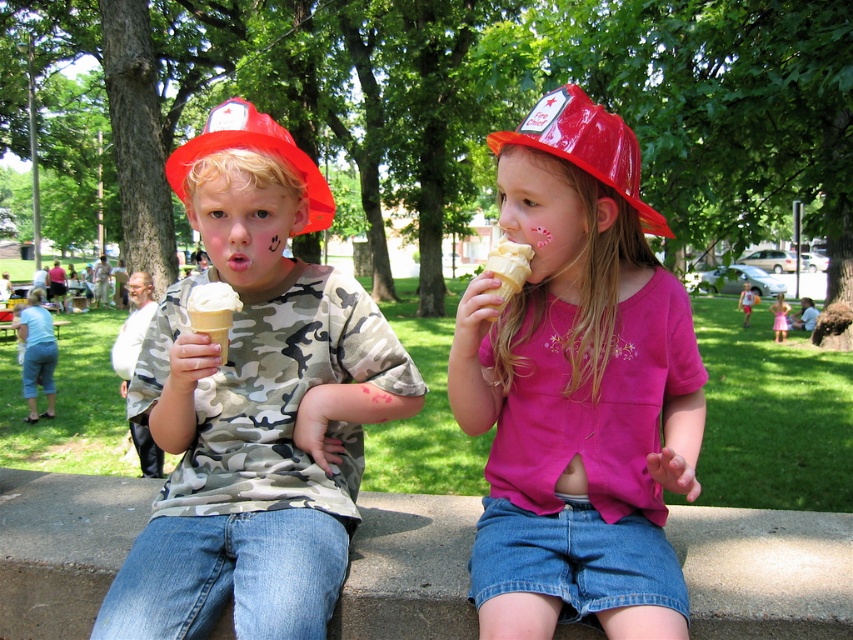
You are a photographer trying to capture both the white creamy ice cream cone at center and the vanilla ice cream at center in a single shot. Given that your camera has a maximum focus range of 25 inches, will you be able to include both in the frame without moving the camera?

The distance between the white creamy ice cream cone at center and the vanilla ice cream at center is 25.49 inches. Since this exceeds the camera maximum focus range of 25 inches, you will not be able to include both in the frame without moving the camera.

You are a photographer trying to capture a photo of the vanilla ice cream at center and the pink satin dress at center. If you want to ensure both objects are fully visible in the frame, which object should you adjust your focus to prioritize based on their sizes?

The vanilla ice cream at center is wider than the pink satin dress at center, so you should prioritize focusing on the vanilla ice cream at center to ensure it fits within the frame.

You are a photographer taking a picture of the vanilla ice cream at center and the pink satin dress at center. Which object should you focus on first if you want to capture both in the same frame without moving the camera?

The vanilla ice cream at center is taller than the pink satin dress at center, so you should focus on the vanilla ice cream at center first to ensure it fits within the frame.